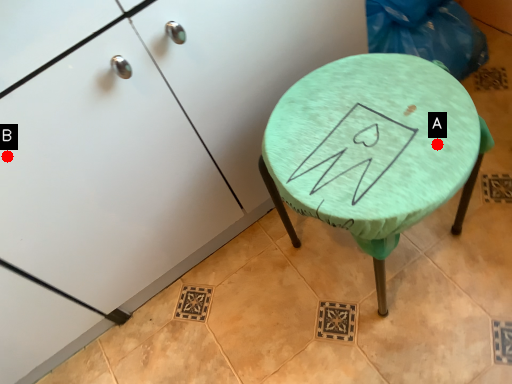
Question: Two points are circled on the image, labeled by A and B beside each circle. Which point is farther from the camera taking this photo?

Choices:
 (A) A is further
 (B) B is further

Answer: (B)